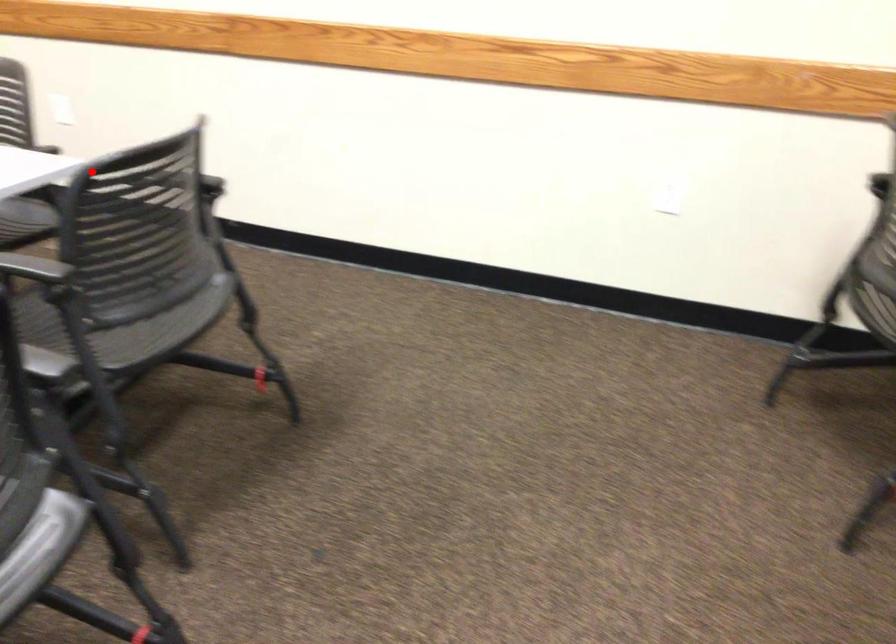
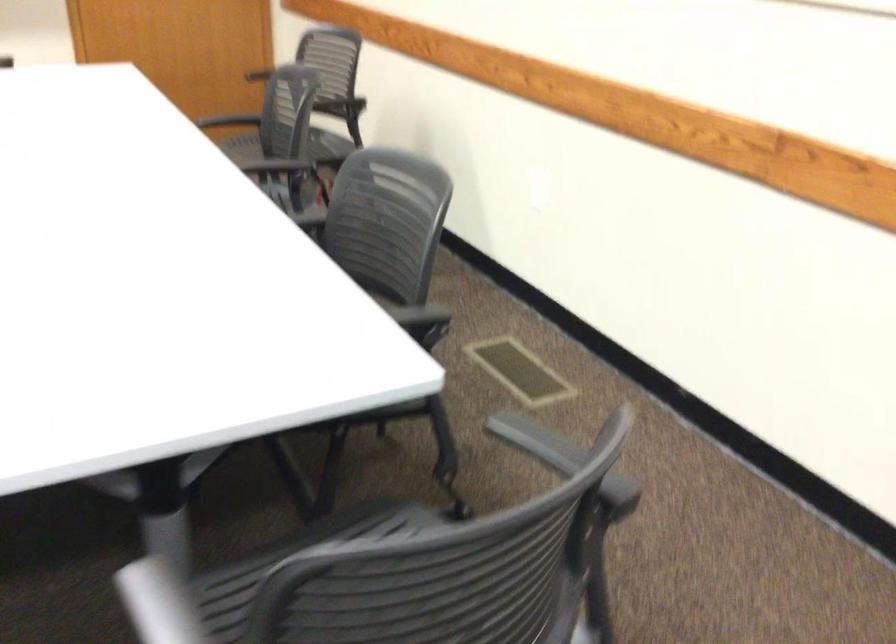
Question: I am providing you with two images of the same scene from different viewpoints. In image1, a red point is highlighted. Considering the same 3D point in image2, which of the following is correct?

Choices:
 (A) It is closer
 (B) It is farther

Answer: (A)